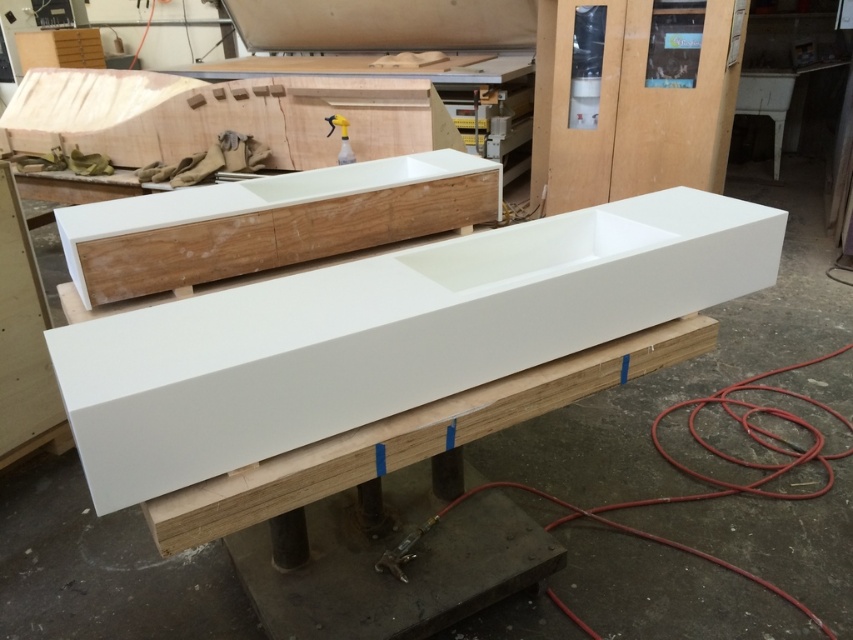
You are an artist working in the workshop and need to choose a surface to paint on. The white glossy trough at center and the matte white plywood at center are both available. Which surface has a larger area for painting?

The white glossy trough at center has a larger area for painting since it is bigger than the matte white plywood at center.

You are an artist working in a workshop and need to place a 1.2 meter wide sculpture between the white glossy trough at center and the matte white plywood at center. Can you fit it there?

The white glossy trough at center might be wider than matte white plywood at center, so the sculpture may not fit between them if the trough is wider. Check the actual width first.